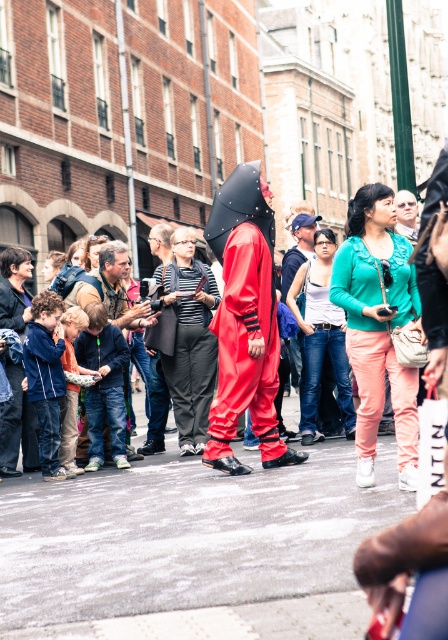
Does teal matte blouse at center come behind striped fabric jacket at center?

No, it is in front of striped fabric jacket at center.

Is point (348, 337) positioned before point (193, 262)?

That is True.

Between point (347, 317) and point (205, 433), which one is positioned behind?

Point (205, 433)

Find the location of a particular element. teal matte blouse at center is located at coordinates (378, 339).

Can you confirm if striped fabric jacket at center is shorter than matte red suit at center?

Yes, striped fabric jacket at center is shorter than matte red suit at center.

Does striped fabric jacket at center have a greater height compared to matte red suit at center?

No.

Which is in front, point (193, 362) or point (321, 324)?

Point (193, 362) is more forward.

Locate an element on the screen. This screenshot has width=448, height=640. striped fabric jacket at center is located at coordinates (189, 340).

Can you confirm if matte red suit at center is positioned above denim jacket at center?

Incorrect, matte red suit at center is not positioned above denim jacket at center.

The image size is (448, 640). What do you see at coordinates (322, 362) in the screenshot? I see `matte red suit at center` at bounding box center [322, 362].

Identify the location of matte red suit at center. (322, 362).